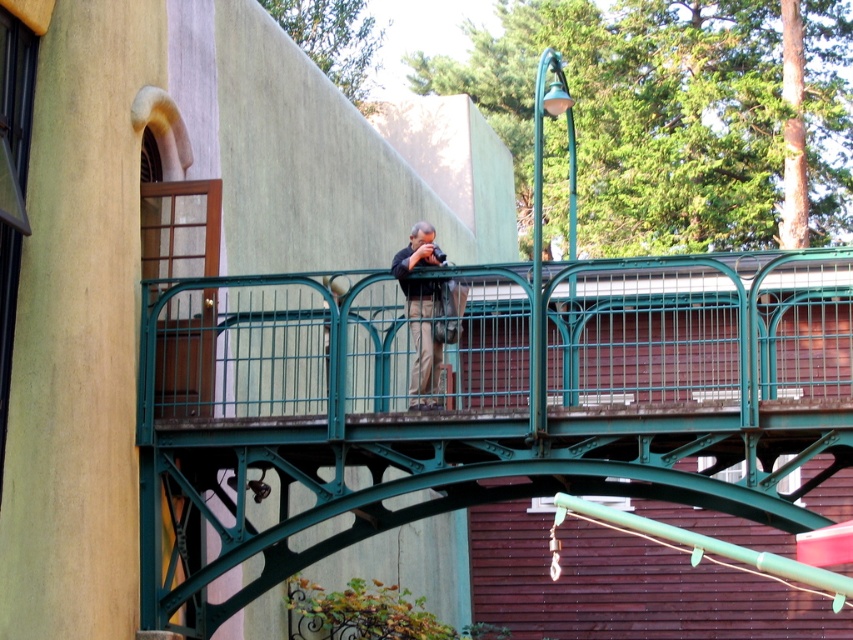
Question: Which object is farther from the camera taking this photo?

Choices:
 (A) black fabric camera at center
 (B) green metal bridge at center

Answer: (A)

Question: Can you confirm if green metal bridge at center is thinner than black fabric camera at center?

Choices:
 (A) no
 (B) yes

Answer: (A)

Question: Which point appears closest to the camera in this image?

Choices:
 (A) (432, 284)
 (B) (482, 316)

Answer: (B)

Question: Can you confirm if green metal bridge at center is smaller than black fabric camera at center?

Choices:
 (A) no
 (B) yes

Answer: (A)

Question: Where is green metal bridge at center located in relation to black fabric camera at center in the image?

Choices:
 (A) above
 (B) below

Answer: (B)

Question: Which of the following is the closest to the observer?

Choices:
 (A) green metal bridge at center
 (B) black fabric camera at center

Answer: (A)